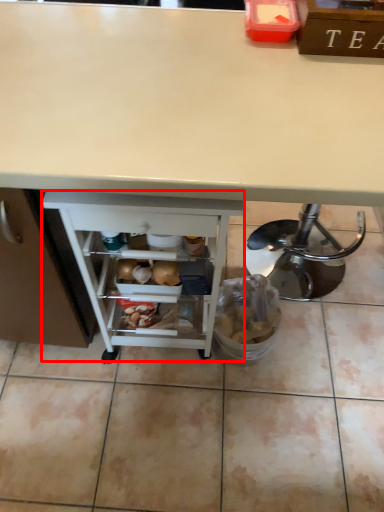
Question: From the image, what is the correct spatial relationship of shelf (annotated by the red box) in relation to desk?

Choices:
 (A) left
 (B) right

Answer: (A)